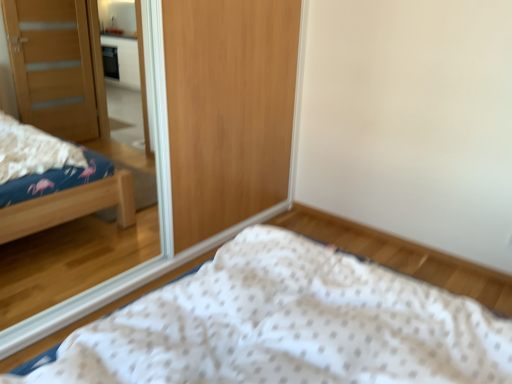
Question: Is white dotted fabric at lower center behind wooden mirror at upper left?

Choices:
 (A) yes
 (B) no

Answer: (B)

Question: Can we say white dotted fabric at lower center lies outside wooden mirror at upper left?

Choices:
 (A) no
 (B) yes

Answer: (B)

Question: Is white dotted fabric at lower center wider than wooden mirror at upper left?

Choices:
 (A) no
 (B) yes

Answer: (B)

Question: Would you say white dotted fabric at lower center contains wooden mirror at upper left?

Choices:
 (A) yes
 (B) no

Answer: (B)

Question: From the image's perspective, is white dotted fabric at lower center located beneath wooden mirror at upper left?

Choices:
 (A) yes
 (B) no

Answer: (A)

Question: Is white dotted fabric at lower center touching wooden mirror at upper left?

Choices:
 (A) no
 (B) yes

Answer: (A)

Question: Can you confirm if wooden mirror at upper left is taller than white dotted fabric at lower center?

Choices:
 (A) yes
 (B) no

Answer: (A)

Question: From a real-world perspective, is wooden mirror at upper left on white dotted fabric at lower center?

Choices:
 (A) yes
 (B) no

Answer: (A)

Question: Is wooden mirror at upper left thinner than white dotted fabric at lower center?

Choices:
 (A) yes
 (B) no

Answer: (A)

Question: Is there a large distance between wooden mirror at upper left and white dotted fabric at lower center?

Choices:
 (A) yes
 (B) no

Answer: (A)

Question: Is wooden mirror at upper left positioned behind white dotted fabric at lower center?

Choices:
 (A) yes
 (B) no

Answer: (A)

Question: Does wooden mirror at upper left touch white dotted fabric at lower center?

Choices:
 (A) yes
 (B) no

Answer: (B)

Question: From the image's perspective, is wooden mirror at upper left positioned above or below white dotted fabric at lower center?

Choices:
 (A) below
 (B) above

Answer: (B)